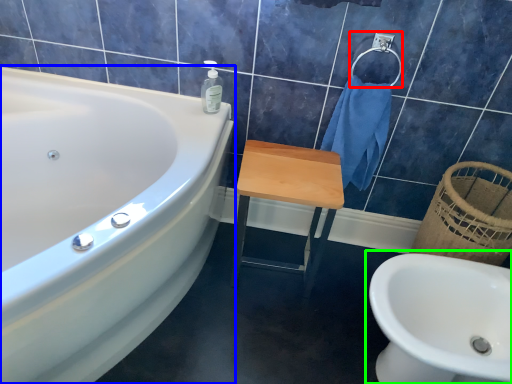
Question: Which object is positioned farthest from towel bar (highlighted by a red box)? Select from bathtub (highlighted by a blue box) and sink (highlighted by a green box).

Choices:
 (A) bathtub
 (B) sink

Answer: (A)